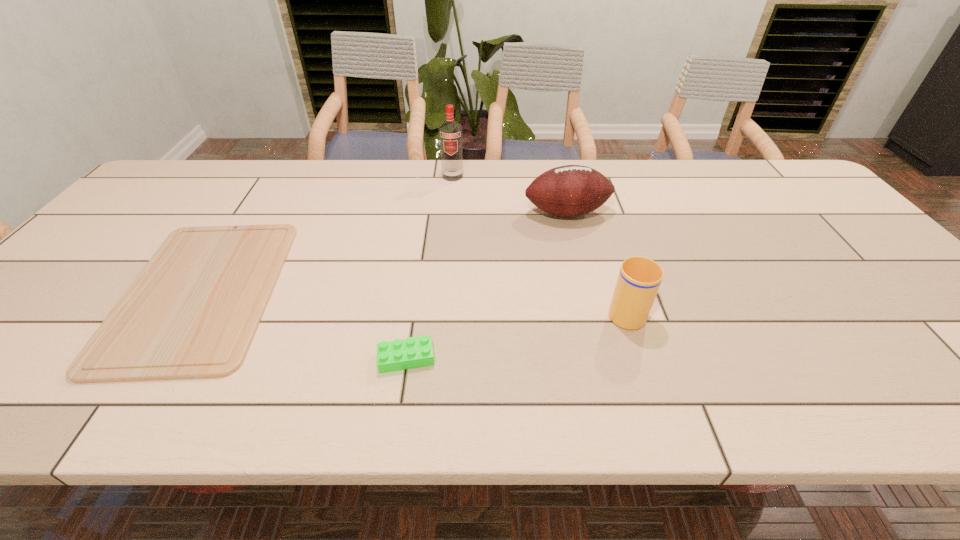
This screenshot has width=960, height=540. Identify the location of free region located 0.240m on the side of the cup with the handle. click(599, 231).

This screenshot has width=960, height=540. What are the coordinates of `vacant space situated 0.140m on the side of the cup with the handle` in the screenshot? It's located at (607, 254).

Locate an element on the screen. This screenshot has height=540, width=960. free location located 0.090m on the left of the fourth tallest object is located at coordinates (334, 359).

Locate an element on the screen. This screenshot has height=540, width=960. vacant position located 0.060m on the right of the leftmost object is located at coordinates (302, 292).

Find the location of `vodka that is at the far edge`. vodka that is at the far edge is located at coordinates (450, 132).

The height and width of the screenshot is (540, 960). What are the coordinates of `football (American) that is at the far edge` in the screenshot? It's located at (572, 190).

The width and height of the screenshot is (960, 540). What are the coordinates of `object situated at the near edge` in the screenshot? It's located at (192, 312).

This screenshot has height=540, width=960. Find the location of `vacant area at the far edge of the desktop`. vacant area at the far edge of the desktop is located at coordinates (211, 194).

Where is `vacant space at the near edge`? The image size is (960, 540). vacant space at the near edge is located at coordinates (752, 390).

What are the coordinates of `vacant space at the right edge` in the screenshot? It's located at (906, 335).